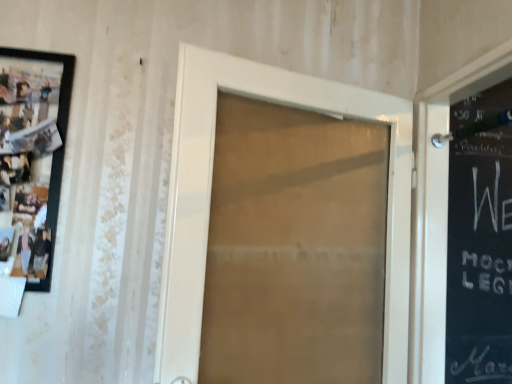
Question: In terms of height, does matte black picture frame at left look taller or shorter compared to white glossy door at center?

Choices:
 (A) short
 (B) tall

Answer: (A)

Question: Looking at their shapes, would you say matte black picture frame at left is wider or thinner than white glossy door at center?

Choices:
 (A) wide
 (B) thin

Answer: (B)

Question: From a real-world perspective, is matte black picture frame at left physically located above or below white glossy door at center?

Choices:
 (A) above
 (B) below

Answer: (A)

Question: Considering the positions of point (396, 218) and point (22, 81), is point (396, 218) closer or farther from the camera than point (22, 81)?

Choices:
 (A) farther
 (B) closer

Answer: (A)

Question: Considering the relative positions of white glossy door at center and matte black picture frame at left in the image provided, is white glossy door at center to the left or to the right of matte black picture frame at left?

Choices:
 (A) right
 (B) left

Answer: (A)

Question: From a real-world perspective, is white glossy door at center positioned above or below matte black picture frame at left?

Choices:
 (A) below
 (B) above

Answer: (A)

Question: Considering the positions of white glossy door at center and matte black picture frame at left in the image, is white glossy door at center taller or shorter than matte black picture frame at left?

Choices:
 (A) short
 (B) tall

Answer: (B)